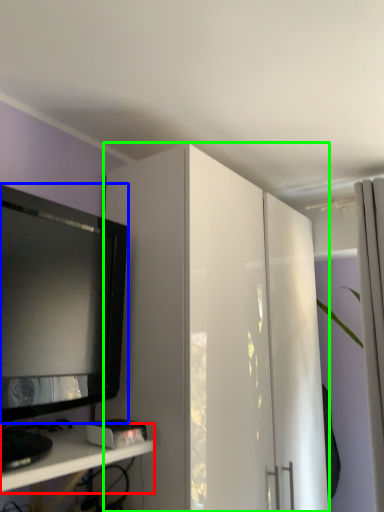
Question: Estimate the real-world distances between objects in this image. Which object is farther from shelf (highlighted by a red box), television (highlighted by a blue box) or cabinetry (highlighted by a green box)?

Choices:
 (A) television
 (B) cabinetry

Answer: (B)